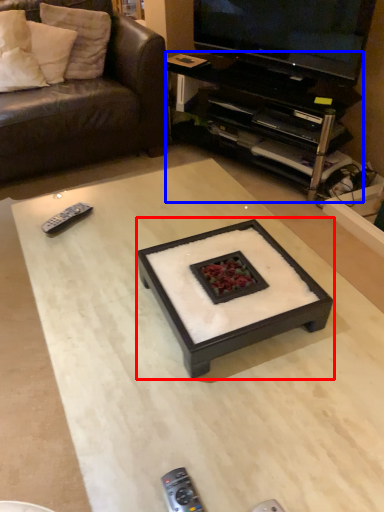
Question: Among these objects, which one is nearest to the camera, coffee table (highlighted by a red box) or desk (highlighted by a blue box)?

Choices:
 (A) coffee table
 (B) desk

Answer: (A)